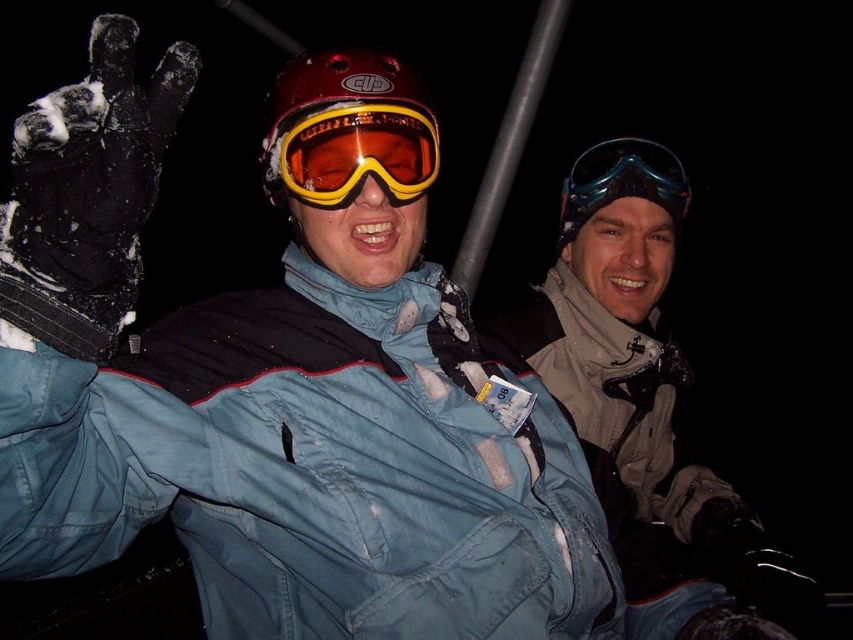
Is yellow matte/glossy goggles at center above transparent blue goggles at upper center?

No, yellow matte/glossy goggles at center is not above transparent blue goggles at upper center.

Does yellow matte/glossy goggles at center appear on the right side of transparent blue goggles at upper center?

Incorrect, yellow matte/glossy goggles at center is not on the right side of transparent blue goggles at upper center.

What are the coordinates of `yellow matte/glossy goggles at center` in the screenshot? It's located at (358, 154).

Locate an element on the screen. The width and height of the screenshot is (853, 640). yellow matte/glossy goggles at center is located at coordinates (358, 154).

Between matte gray jacket at center and transparent blue goggles at upper center, which one is positioned lower?

Positioned lower is matte gray jacket at center.

Is matte gray jacket at center to the right of transparent blue goggles at upper center from the viewer's perspective?

Correct, you'll find matte gray jacket at center to the right of transparent blue goggles at upper center.

At what (x,y) coordinates should I click in order to perform the action: click on matte gray jacket at center. Please return your answer as a coordinate pair (x, y). Looking at the image, I should click on (635, 394).

At what (x,y) coordinates should I click in order to perform the action: click on matte gray jacket at center. Please return your answer as a coordinate pair (x, y). Image resolution: width=853 pixels, height=640 pixels. Looking at the image, I should click on (635, 394).

Is point (596, 218) positioned before point (364, 122)?

No, (596, 218) is behind (364, 122).

Who is lower down, matte gray jacket at center or yellow matte/glossy goggles at center?

matte gray jacket at center

Where is `matte gray jacket at center`? The height and width of the screenshot is (640, 853). matte gray jacket at center is located at coordinates (635, 394).